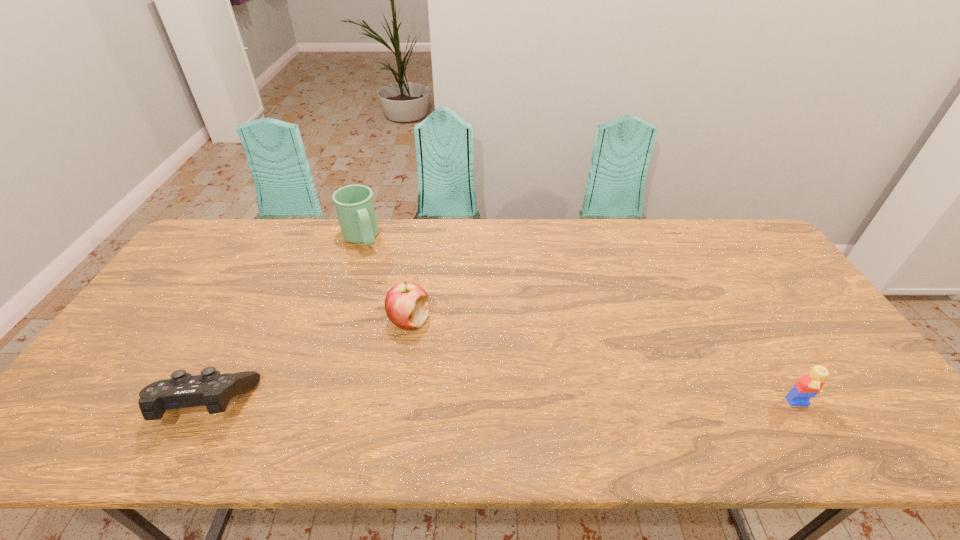
You are a GUI agent. You are given a task and a screenshot of the screen. Output one action in this format:
    pyautogui.click(x=<x>, y=<y>)
    Task: Click on the leftmost object
    This screenshot has width=960, height=540.
    Given the screenshot: What is the action you would take?
    pyautogui.click(x=211, y=389)

Image resolution: width=960 pixels, height=540 pixels. In order to click on control in this screenshot , I will do `click(211, 389)`.

This screenshot has height=540, width=960. Identify the location of Lego. (809, 385).

At what (x,y) coordinates should I click in order to perform the action: click on apple. Please return your answer as a coordinate pair (x, y). The height and width of the screenshot is (540, 960). Looking at the image, I should click on (406, 304).

Find the location of `the third nearest object`. the third nearest object is located at coordinates (406, 304).

The height and width of the screenshot is (540, 960). Find the location of `the tallest object`. the tallest object is located at coordinates (354, 204).

Where is `the farthest object`? the farthest object is located at coordinates (354, 204).

In order to click on free location located 0.080m on the left of the shortest object in this screenshot , I will do `click(122, 404)`.

The image size is (960, 540). I want to click on vacant region located on the bitten side of the third nearest object, so click(433, 411).

Where is `vacant space situated 0.230m on the bitten side of the third nearest object`? vacant space situated 0.230m on the bitten side of the third nearest object is located at coordinates (432, 408).